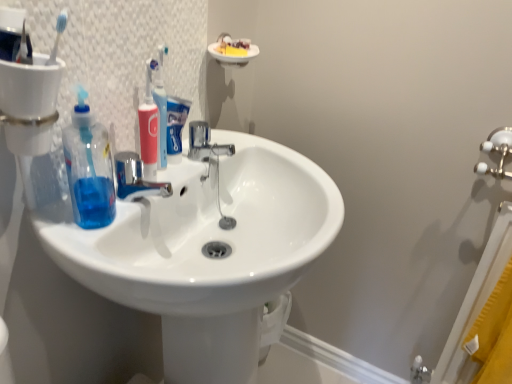
Question: Does transparent blue liquid at sink left have a greater width compared to chrome metallic faucet at center?

Choices:
 (A) yes
 (B) no

Answer: (B)

Question: Is transparent blue liquid at sink left positioned beyond the bounds of chrome metallic faucet at center?

Choices:
 (A) no
 (B) yes

Answer: (B)

Question: Is transparent blue liquid at sink left to the right of chrome metallic faucet at center from the viewer's perspective?

Choices:
 (A) no
 (B) yes

Answer: (A)

Question: Considering the relative sizes of transparent blue liquid at sink left and chrome metallic faucet at center in the image provided, is transparent blue liquid at sink left bigger than chrome metallic faucet at center?

Choices:
 (A) no
 (B) yes

Answer: (B)

Question: From a real-world perspective, is transparent blue liquid at sink left physically below chrome metallic faucet at center?

Choices:
 (A) yes
 (B) no

Answer: (B)

Question: Is point (146, 62) closer or farther from the camera than point (176, 144)?

Choices:
 (A) farther
 (B) closer

Answer: (B)

Question: Considering the positions of pink plastic toothbrush at center and blue matte toothpaste at center in the image, is pink plastic toothbrush at center wider or thinner than blue matte toothpaste at center?

Choices:
 (A) thin
 (B) wide

Answer: (B)

Question: From a real-world perspective, relative to blue matte toothpaste at center, is pink plastic toothbrush at center vertically above or below?

Choices:
 (A) above
 (B) below

Answer: (A)

Question: From the image's perspective, relative to blue matte toothpaste at center, is pink plastic toothbrush at center above or below?

Choices:
 (A) below
 (B) above

Answer: (A)

Question: Relative to white glossy sink at center, is chrome metallic faucet at center in front or behind?

Choices:
 (A) front
 (B) behind

Answer: (B)

Question: Considering the positions of chrome metallic faucet at center and white glossy sink at center in the image, is chrome metallic faucet at center wider or thinner than white glossy sink at center?

Choices:
 (A) wide
 (B) thin

Answer: (B)

Question: Visually, is chrome metallic faucet at center positioned to the left or to the right of white glossy sink at center?

Choices:
 (A) right
 (B) left

Answer: (B)

Question: From a real-world perspective, is chrome metallic faucet at center above or below white glossy sink at center?

Choices:
 (A) above
 (B) below

Answer: (A)

Question: In terms of size, does transparent blue liquid at sink left appear bigger or smaller than chrome metallic faucet at center?

Choices:
 (A) small
 (B) big

Answer: (B)

Question: Considering the positions of point [x=80, y=107] and point [x=222, y=147], is point [x=80, y=107] closer or farther from the camera than point [x=222, y=147]?

Choices:
 (A) closer
 (B) farther

Answer: (A)